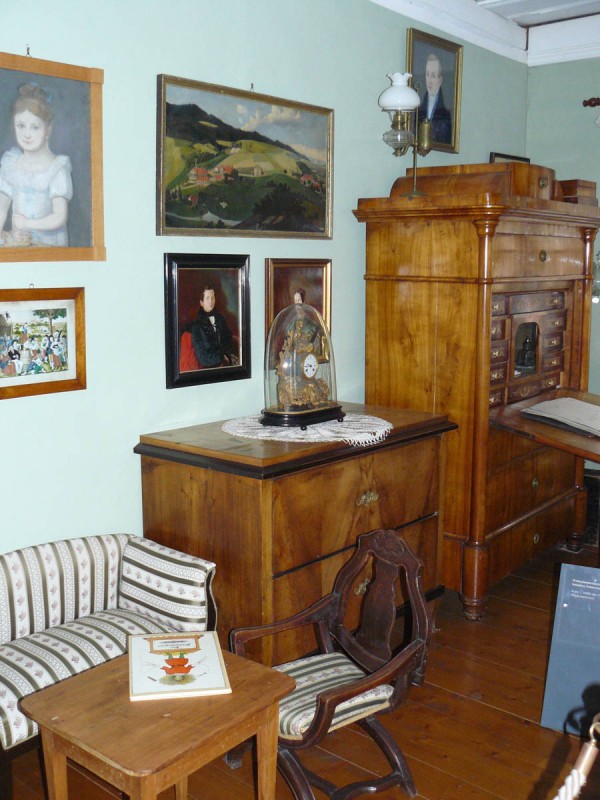
Identify the location of wood floor. (525, 744).